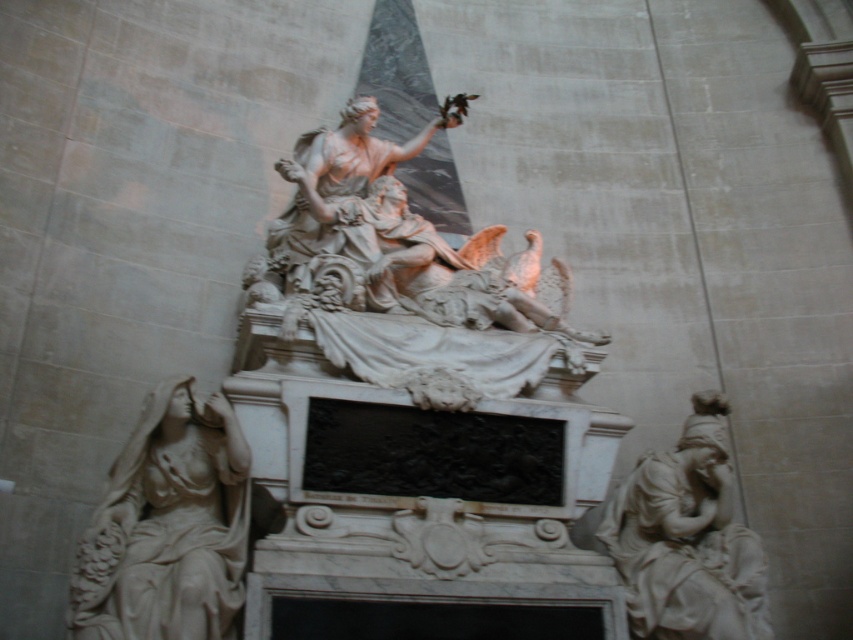
Who is shorter, white marble statue at center or white marble statue at left?

Standing shorter between the two is white marble statue at left.

Can you confirm if white marble statue at center is wider than white marble statue at left?

Indeed, white marble statue at center has a greater width compared to white marble statue at left.

This screenshot has height=640, width=853. I want to click on white marble statue at center, so click(401, 275).

Identify the location of white marble statue at center. Image resolution: width=853 pixels, height=640 pixels. (401, 275).

Is point (300, 170) more distant than point (693, 611)?

Yes.

Is white marble statue at center to the left of white marble statue at lower right from the viewer's perspective?

Correct, you'll find white marble statue at center to the left of white marble statue at lower right.

Describe the element at coordinates (401, 275) in the screenshot. I see `white marble statue at center` at that location.

Where is `white marble statue at center`? white marble statue at center is located at coordinates (401, 275).

Who is more distant from viewer, (120, 484) or (636, 632)?

Point (636, 632)

The image size is (853, 640). Describe the element at coordinates (167, 525) in the screenshot. I see `white marble statue at left` at that location.

At what (x,y) coordinates should I click in order to perform the action: click on white marble statue at left. Please return your answer as a coordinate pair (x, y). Image resolution: width=853 pixels, height=640 pixels. Looking at the image, I should click on (167, 525).